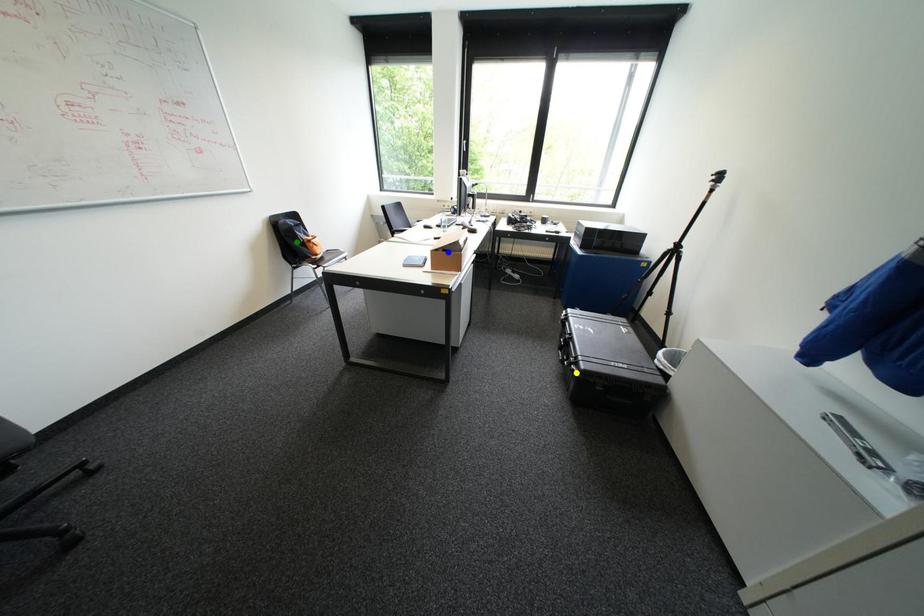
Order these from nearest to farthest:
green point
blue point
yellow point

1. blue point
2. yellow point
3. green point